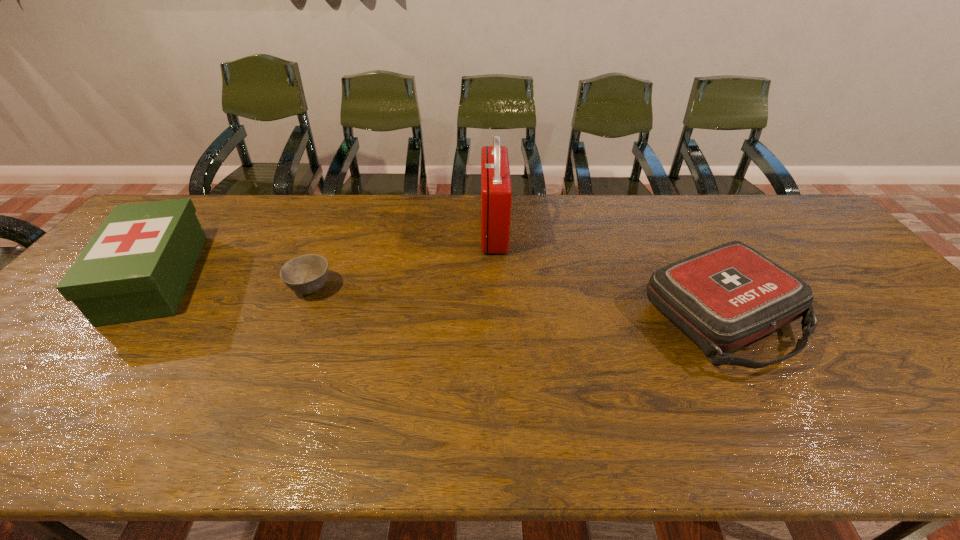
Identify the location of the second closest object to the third shortest object. (496, 193).

What are the coordinates of `the closest first-aid kit to the rightmost first-aid kit` in the screenshot? It's located at (496, 193).

This screenshot has height=540, width=960. What are the coordinates of `the first-aid kit that stands as the second closest to the tallest first-aid kit` in the screenshot? It's located at (137, 265).

Locate an element on the screen. This screenshot has width=960, height=540. free space that satisfies the following two spatial constraints: 1. on the front face of the tallest object; 2. on the front side of the second shortest first-aid kit is located at coordinates (496, 278).

I want to click on free region that satisfies the following two spatial constraints: 1. on the front face of the rightmost object; 2. on the left side of the tallest object, so click(497, 316).

Locate an element on the screen. This screenshot has width=960, height=540. vacant region that satisfies the following two spatial constraints: 1. on the front face of the tallest object; 2. on the front side of the leftmost object is located at coordinates click(496, 278).

Where is `free space that satisfies the following two spatial constraints: 1. on the front face of the third object from left to right; 2. on the left side of the third tallest object`? This screenshot has height=540, width=960. free space that satisfies the following two spatial constraints: 1. on the front face of the third object from left to right; 2. on the left side of the third tallest object is located at coordinates (497, 316).